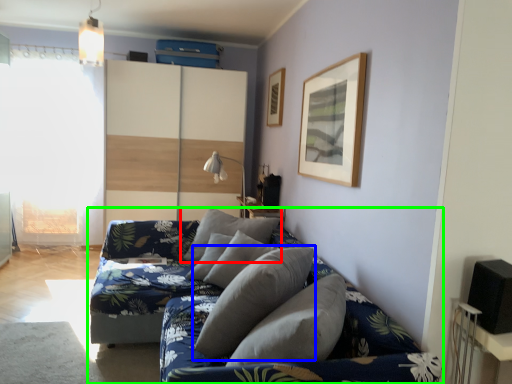
Question: Estimate the real-world distances between objects in this image. Which object is closer to pillow (highlighted by a red box), pillow (highlighted by a blue box) or studio couch (highlighted by a green box)?

Choices:
 (A) pillow
 (B) studio couch

Answer: (B)